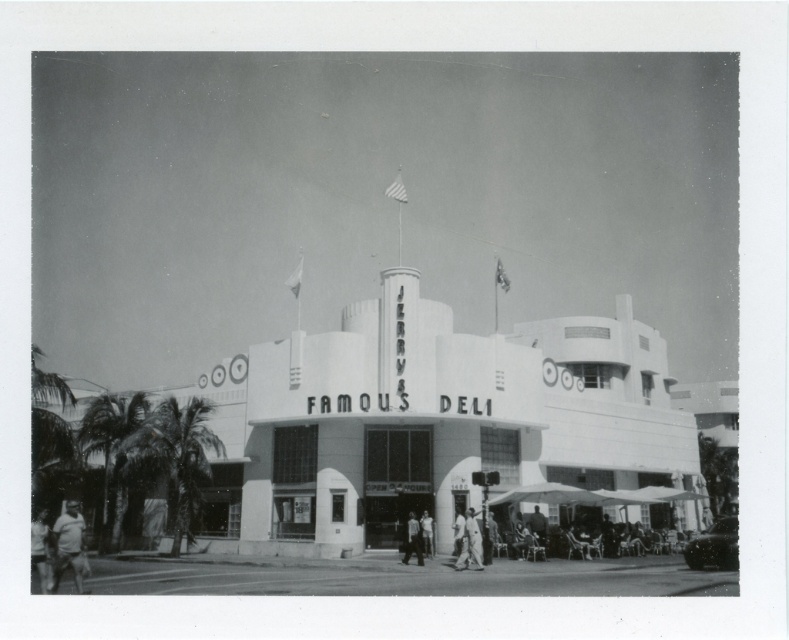
Question: Which object is closer to the camera taking this photo?

Choices:
 (A) light skin tone shirt at center
 (B) smooth skin person at lower left

Answer: (B)

Question: Considering the real-world distances, which object is farthest from the smooth skin person at center?

Choices:
 (A) light skin tone shirt at lower left
 (B) light skin tone shirt at center
 (C) white cotton shirt at center
 (D) smooth skin person at lower left

Answer: (D)

Question: Does light skin tone shirt at lower left have a greater width compared to smooth skin person at lower left?

Choices:
 (A) no
 (B) yes

Answer: (B)

Question: Which point appears closest to the camera in this image?

Choices:
 (A) (62, 550)
 (B) (49, 568)
 (C) (412, 520)
 (D) (466, 545)

Answer: (B)

Question: Does smooth skin person at lower left have a larger size compared to light skin tone shirt at center?

Choices:
 (A) no
 (B) yes

Answer: (B)

Question: Does smooth skin person at center lie in front of light skin tone shirt at center?

Choices:
 (A) no
 (B) yes

Answer: (A)